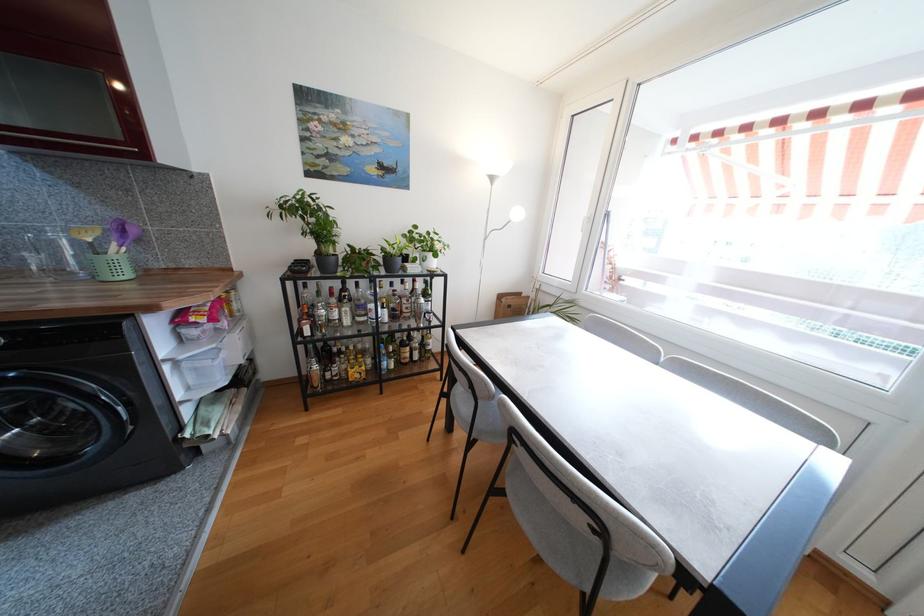
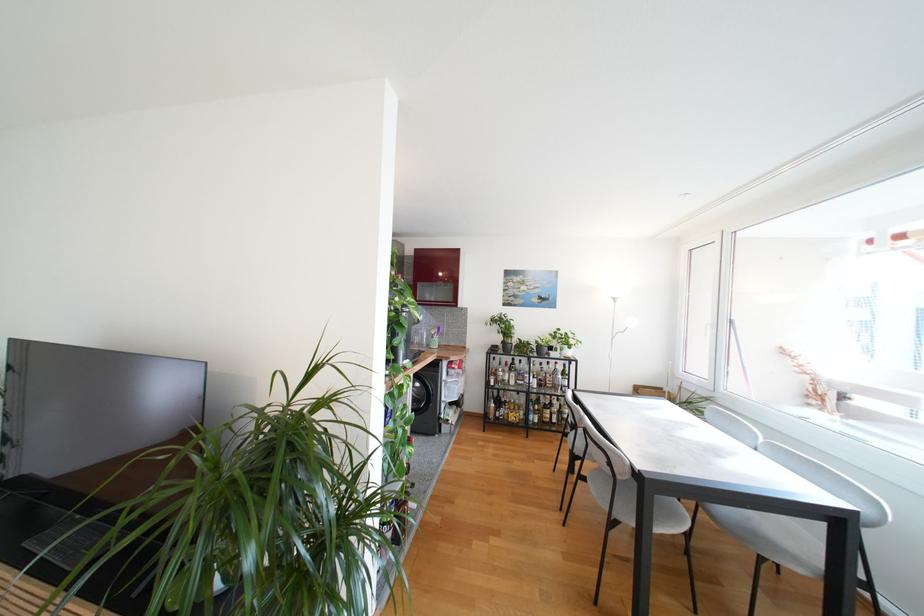
Locate, in the second image, the point that corresponds to (x=378, y=312) in the first image.

(532, 379)